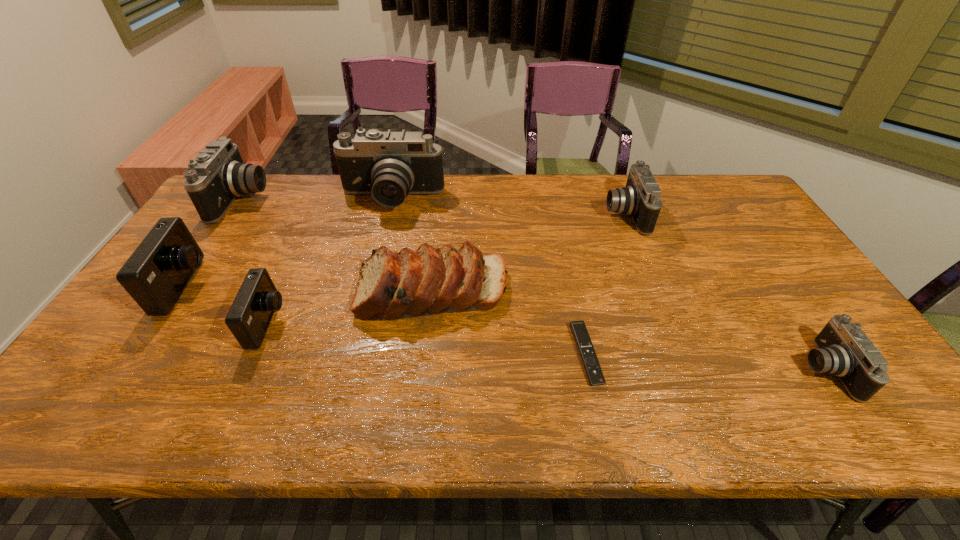
The image size is (960, 540). What are the coordinates of `vacant space positioned 0.210m on the front of the bread` in the screenshot? It's located at (421, 396).

What are the coordinates of `vacant space located 0.190m on the front-facing side of the third camera from left to right` in the screenshot? It's located at (357, 323).

Locate an element on the screen. This screenshot has height=540, width=960. vacant space located 0.320m on the front-facing side of the rightmost camera is located at coordinates (667, 369).

Locate an element on the screen. free spot located 0.240m on the front-facing side of the rightmost camera is located at coordinates (702, 369).

You are a GUI agent. You are given a task and a screenshot of the screen. Output one action in this format:
    pyautogui.click(x=<x>, y=<y>)
    Task: Click on the vacant space located 0.350m on the front-facing side of the rightmost camera
    
    Given the screenshot: What is the action you would take?
    pyautogui.click(x=655, y=369)

You are a GUI agent. You are given a task and a screenshot of the screen. Output one action in this format:
    pyautogui.click(x=<x>, y=<y>)
    Task: Click on the vacant space located 0.060m on the back of the shortest object
    Image resolution: width=960 pixels, height=540 pixels.
    Given the screenshot: What is the action you would take?
    coord(576,307)

Where is `object at the near edge`? object at the near edge is located at coordinates (843, 349).

Find the location of `object present at the right edge`. object present at the right edge is located at coordinates (843, 349).

This screenshot has width=960, height=540. What are the coordinates of `object present at the far left corner` in the screenshot? It's located at point(217,176).

The height and width of the screenshot is (540, 960). In order to click on object that is at the near right corner in this screenshot , I will do `click(843, 349)`.